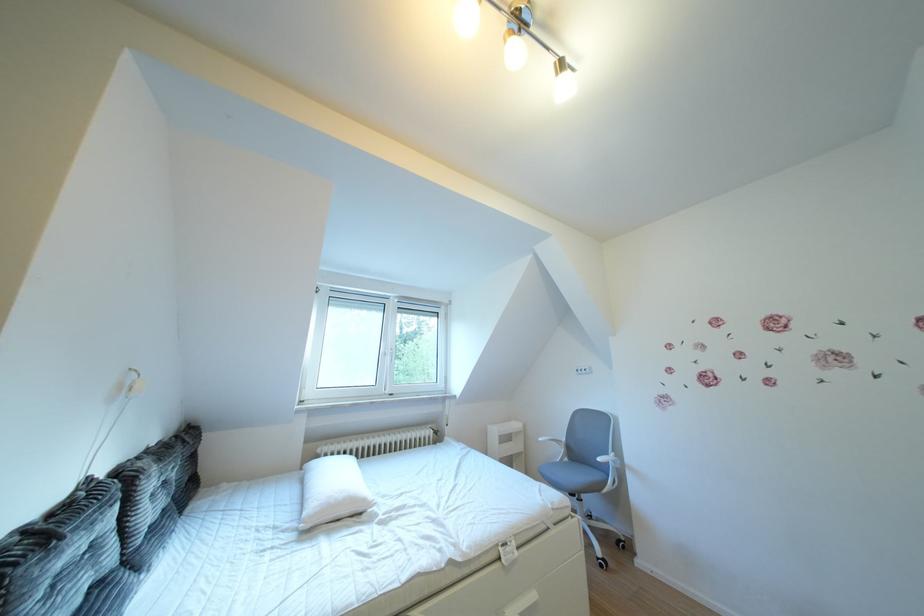
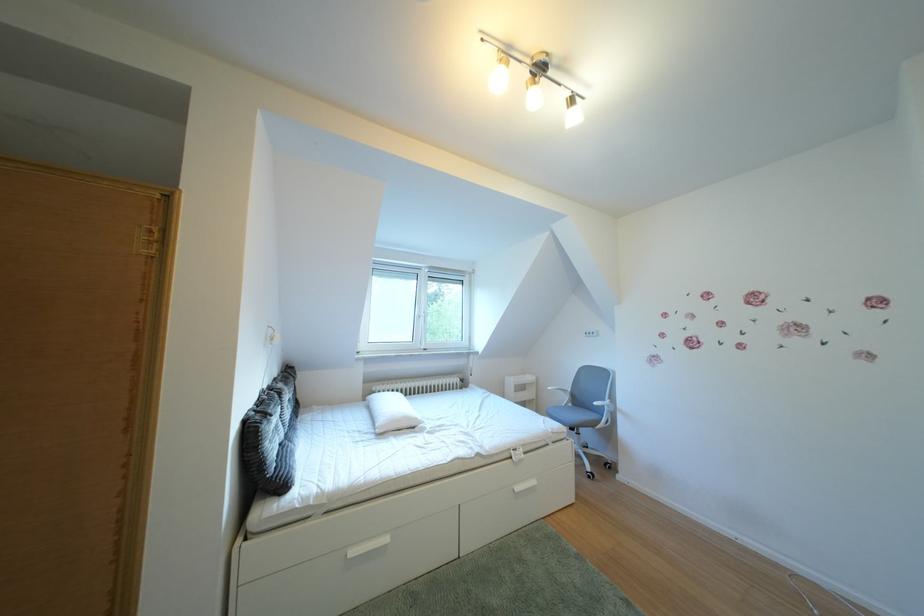
Question: How did the camera likely rotate?

Choices:
 (A) Left
 (B) Right
 (C) Up
 (D) Down

Answer: (D)